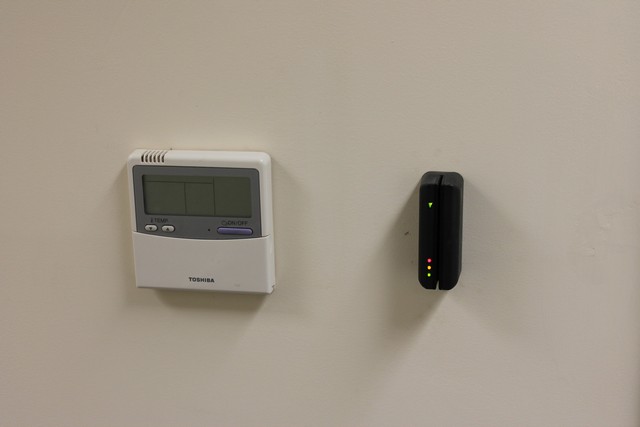
I want to click on green light, so click(429, 205), click(429, 276).